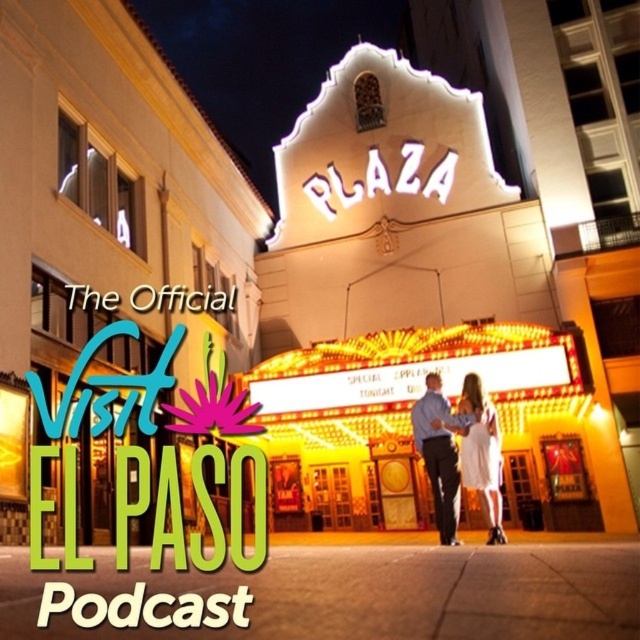
Based on the photo, you are standing at the Plaza Theatre entrance and see a couple walking hand in hand. The man is wearing a blue shirt at center and the woman is wearing a white satin dress at center. Which one is closer to you?

The blue shirt at center is closer to the viewer than the white satin dress at center.

You are a photographer standing in front of the Plaza Theatre. You want to take a photo of the yellow neon sign at center and the white satin dress at center. Which object should you focus on first if you want to capture both in one shot without zooming in or out?

The yellow neon sign at center is bigger than the white satin dress at center, so you should focus on the yellow neon sign at center first to ensure it fits properly in the frame before adjusting for the smaller white satin dress at center.